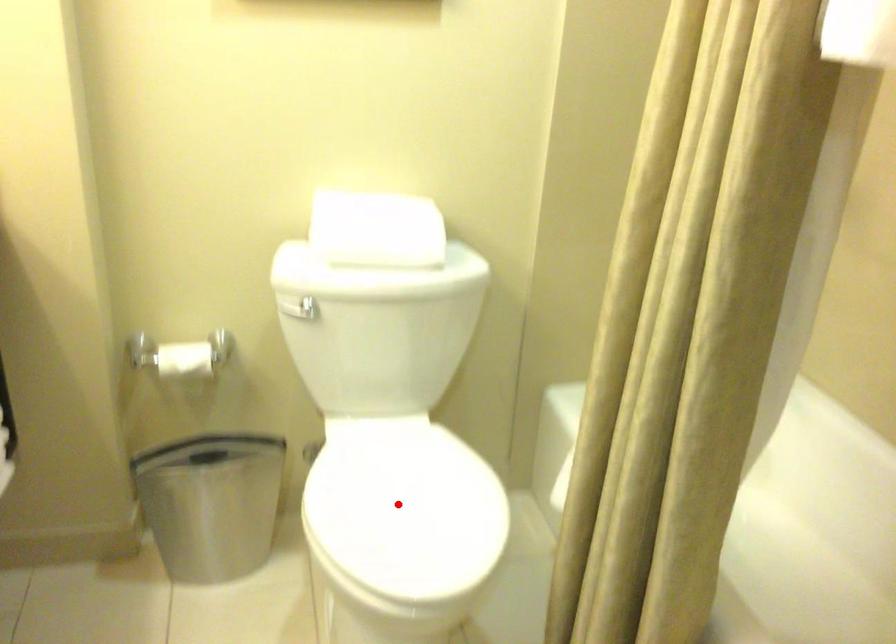
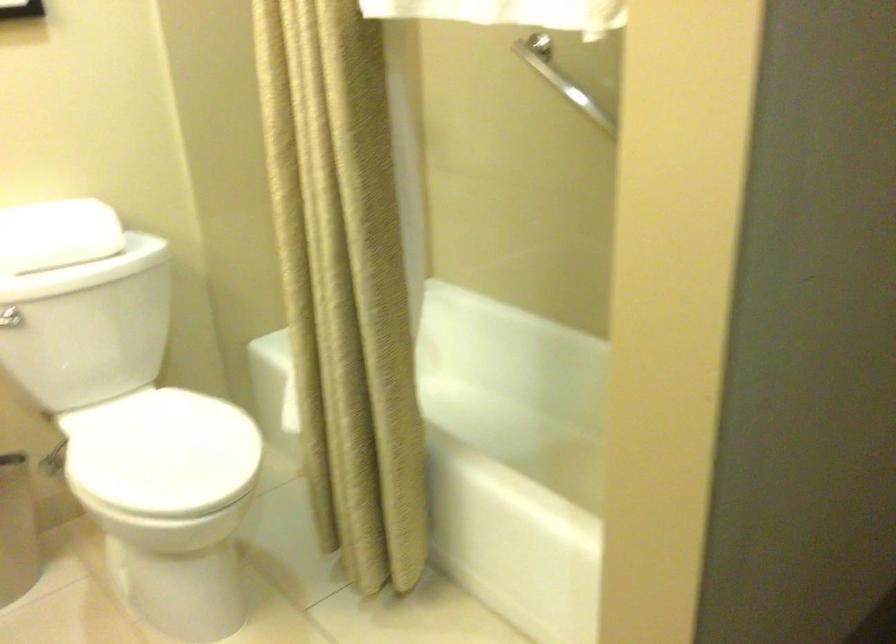
Question: I am providing you with two images of the same scene from different viewpoints. A red point is shown in image1. For the corresponding object point in image2, is it positioned nearer or farther from the camera?

Choices:
 (A) Nearer
 (B) Farther

Answer: (B)